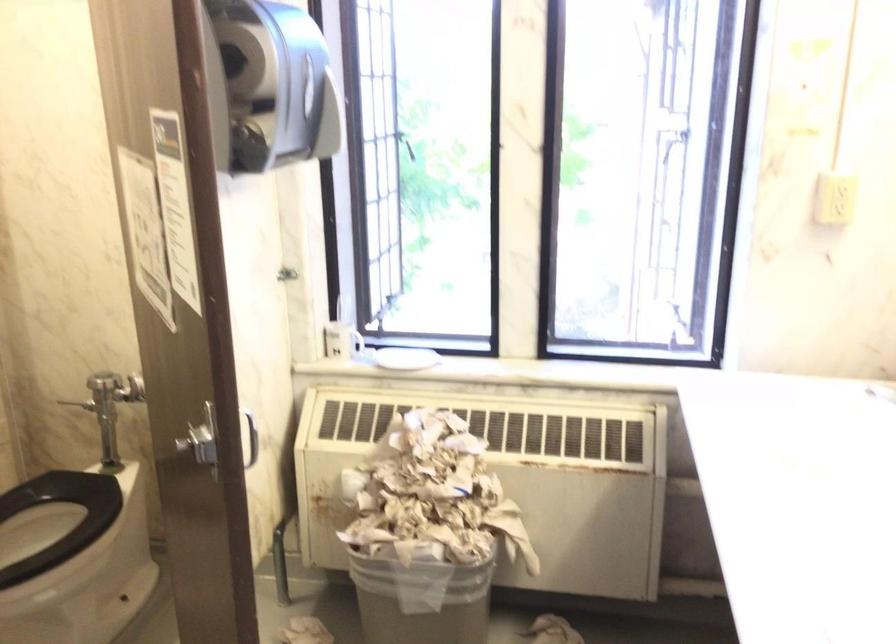
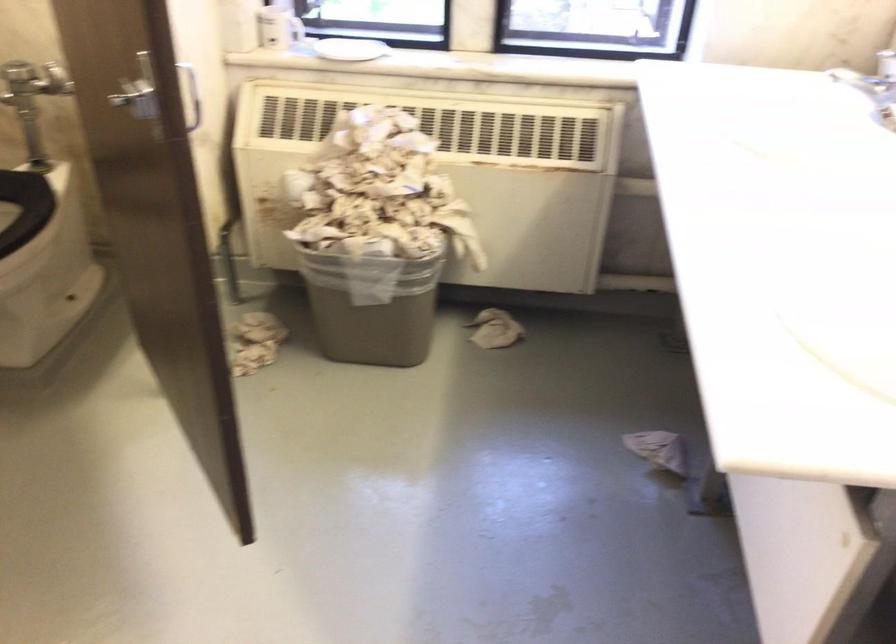
The point at (118, 390) is marked in the first image. Where is the corresponding point in the second image?

(32, 80)